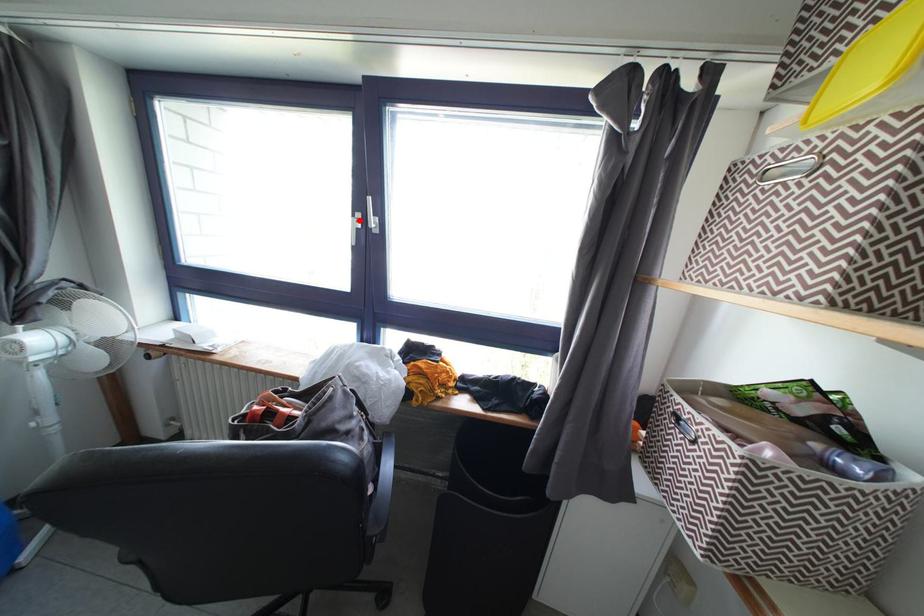
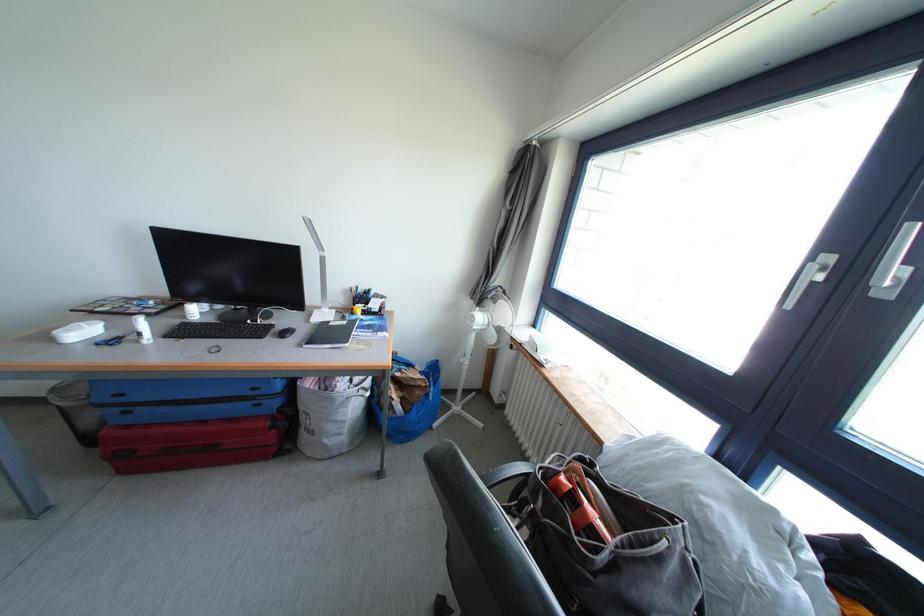
In the second image, find the point that corresponds to the highlighted location in the first image.

(819, 262)